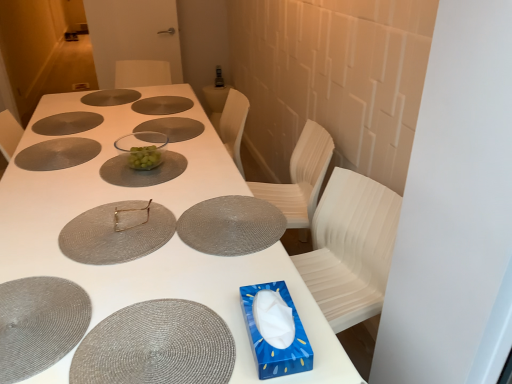
You are a GUI agent. You are given a task and a screenshot of the screen. Output one action in this format:
    pyautogui.click(x=<x>, y=<y>)
    Task: Click on the unoccupied space behind matte gray placemat at center, arranged as the second glass plate when viewed from the front
    Image resolution: width=512 pixels, height=384 pixels.
    Given the screenshot: What is the action you would take?
    pyautogui.click(x=129, y=180)